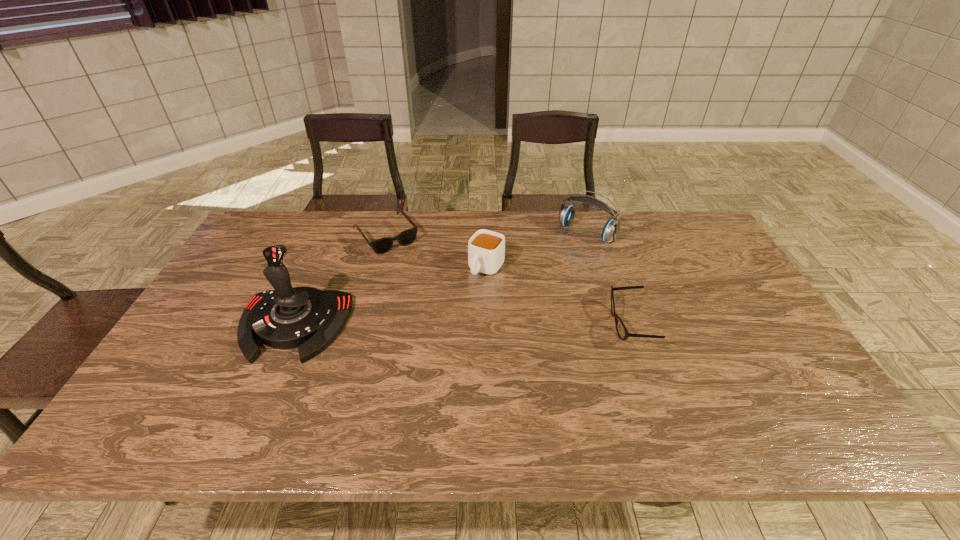
This screenshot has height=540, width=960. What are the coordinates of `the tallest object` in the screenshot? It's located at (308, 318).

The image size is (960, 540). I want to click on spectacles, so coord(622,332).

Where is `sunglasses`? sunglasses is located at coordinates (380, 246).

At what (x,y) coordinates should I click in order to perform the action: click on the second tallest object. Please return your answer as a coordinate pair (x, y). The image size is (960, 540). Looking at the image, I should click on (611, 229).

Locate an element on the screen. the third tallest object is located at coordinates (486, 249).

Find the location of a particular element. the third object from right to left is located at coordinates (486, 249).

Image resolution: width=960 pixels, height=540 pixels. I want to click on vacant space located 0.100m on the handle side of the tallest object, so click(x=262, y=399).

At what (x,y) coordinates should I click in order to perform the action: click on free space located on the front-facing side of the spectacles. Please return your answer as a coordinate pair (x, y). Looking at the image, I should click on (563, 325).

Locate an element on the screen. vacant point located 0.160m on the front-facing side of the spectacles is located at coordinates (551, 325).

The width and height of the screenshot is (960, 540). I want to click on vacant position located 0.400m on the front-facing side of the spectacles, so click(x=463, y=325).